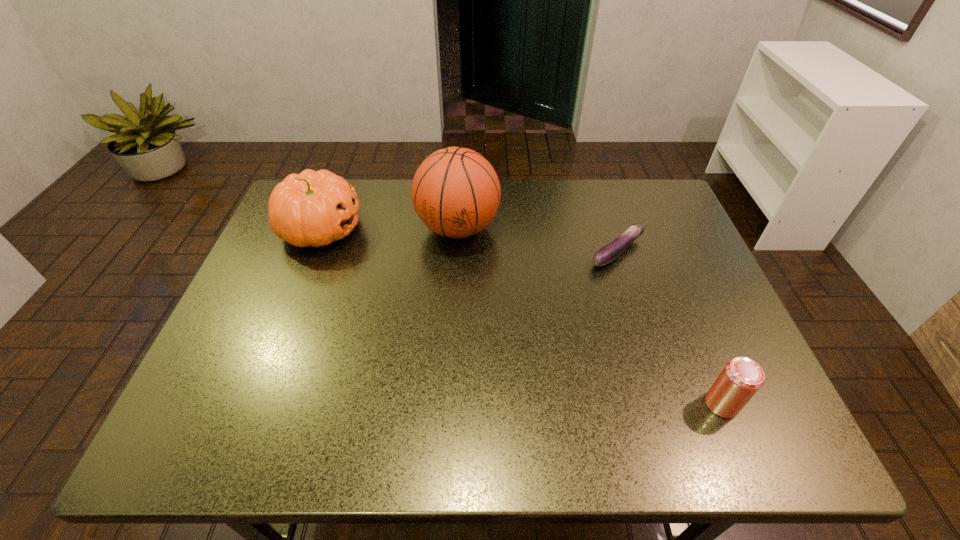
Locate an element on the screen. free location located on the front of the shortest object is located at coordinates (653, 363).

The height and width of the screenshot is (540, 960). What are the coordinates of `basketball located at the far edge` in the screenshot? It's located at (455, 192).

You are a GUI agent. You are given a task and a screenshot of the screen. Output one action in this format:
    pyautogui.click(x=<x>, y=<y>)
    Task: Click on the pumpkin at the far edge
    The image size is (960, 540).
    Given the screenshot: What is the action you would take?
    pyautogui.click(x=313, y=208)

At what (x,y) coordinates should I click in order to perform the action: click on object that is at the near edge. Please return your answer as a coordinate pair (x, y). This screenshot has height=540, width=960. Looking at the image, I should click on (741, 378).

Find the location of a particular element. The width and height of the screenshot is (960, 540). object that is at the left edge is located at coordinates (313, 208).

You are a GUI agent. You are given a task and a screenshot of the screen. Output one action in this format:
    pyautogui.click(x=<x>, y=<y>)
    Task: Click on the beer can at the right edge
    
    Given the screenshot: What is the action you would take?
    pyautogui.click(x=741, y=378)

This screenshot has height=540, width=960. Find the location of `eggplant that is at the right edge`. eggplant that is at the right edge is located at coordinates (608, 253).

I want to click on object at the far left corner, so click(313, 208).

Find the location of `object that is positioned at the near right corner`. object that is positioned at the near right corner is located at coordinates (741, 378).

Identify the location of free space at the far edge of the desktop. (372, 197).